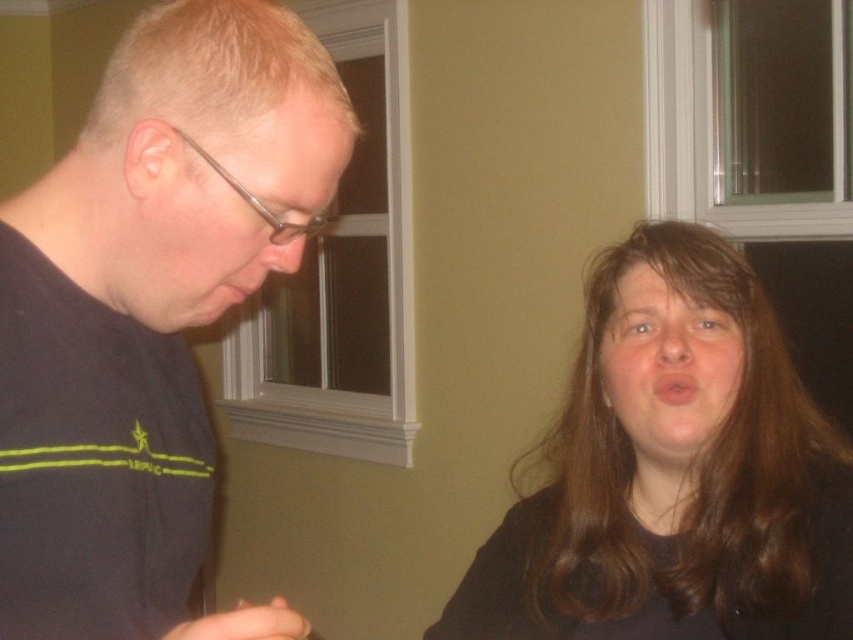
You are standing in the room and want to touch both points on the wall. Which point should you reach for first, point (167, 154) or point (627, 320)?

Point (167, 154) is closer to the viewer than point (627, 320), so you should reach for point (167, 154) first.

You are a photographer setting up for a portrait. You notice two matte black objects in the scene. The matte black glasses at left and the matte black face at center. Which of these two objects is smaller in height?

Answer: The matte black glasses at left has a lesser height compared to the matte black face at center, so the matte black glasses at left is smaller in height.

You are designing a poster and need to know the relative sizes of the objects in the image. Which object is wider, the dark brown hair at upper right or the matte black face at center?

The dark brown hair at upper right is wider than the matte black face at center according to the description.